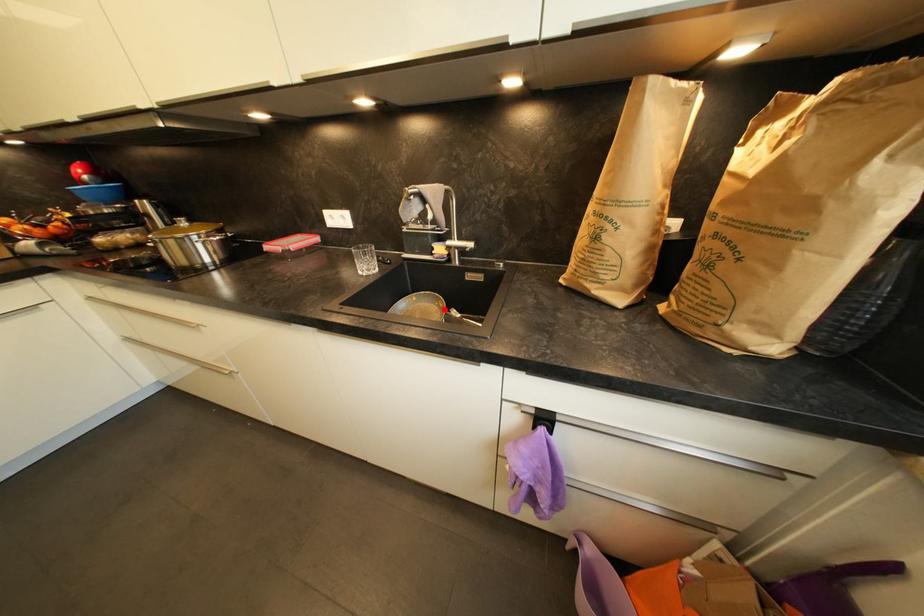
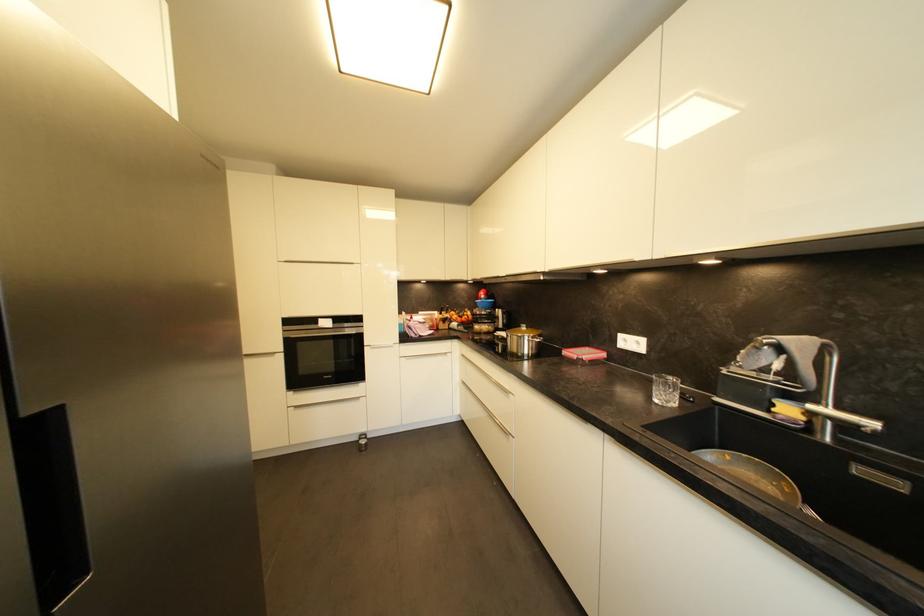
Locate, in the second image, the point that corresponds to the highlighted location in the first image.

(787, 493)